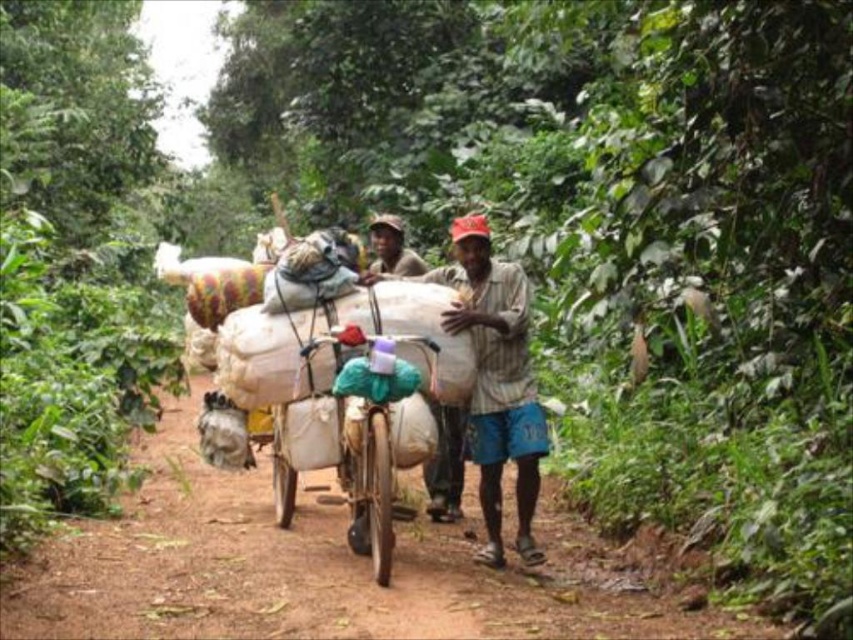
You are a traveler trying to walk along the path. You see the brown dirt track at center and the brown striped shirt at center. Which one should you avoid stepping on to stay on the path?

You should avoid stepping on the brown dirt track at center because it is the path you should follow. The brown striped shirt at center belongs to a person and should not be stepped on either, but the question focuses on staying on the path. However, according to the description, the brown dirt track at center is positioned on the left side of the brown striped shirt at center. To stay on the path, you should follow the dirt track and avoid stepping off onto areas not part of the track.

You are a traveler trying to navigate through the scene. You notice the brown dirt track at center and the matte brown hat at center. Which object is located lower in the image?

The brown dirt track at center is positioned under matte brown hat at center, so the brown dirt track at center is lower in the image.

You are a delivery person trying to navigate a narrow path while carrying a large load. You see the brown dirt track at center and the matte brown hat at center. Which object is smaller in size?

The brown dirt track at center has a smaller size compared to matte brown hat at center, so the brown dirt track at center is smaller in size.